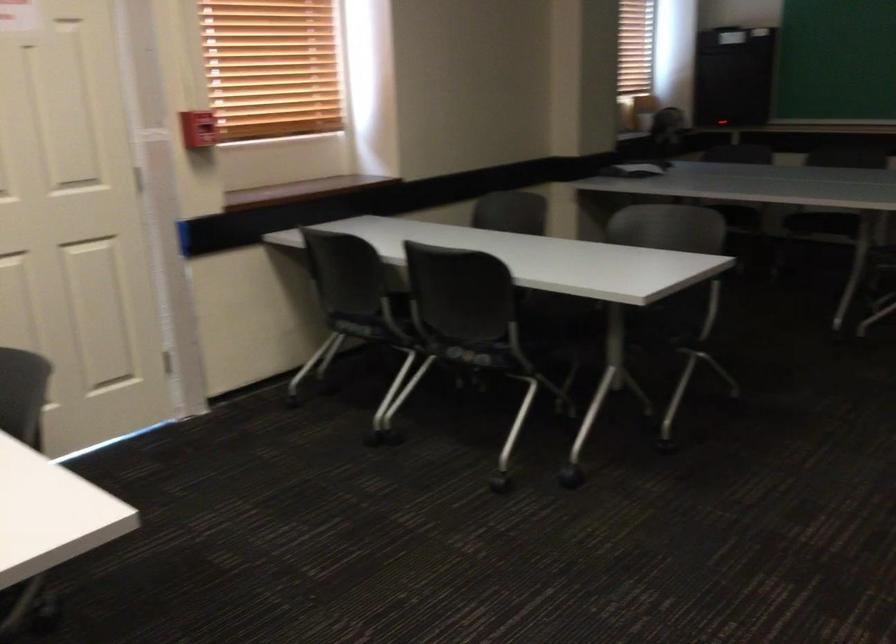
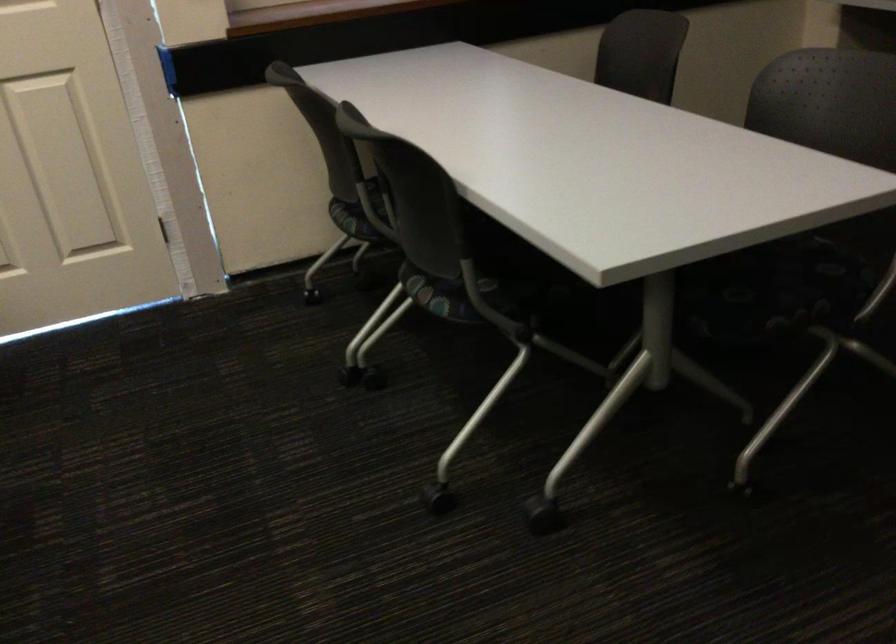
Where in the second image is the point corresponding to the point at 662,342 from the first image?

(748, 326)